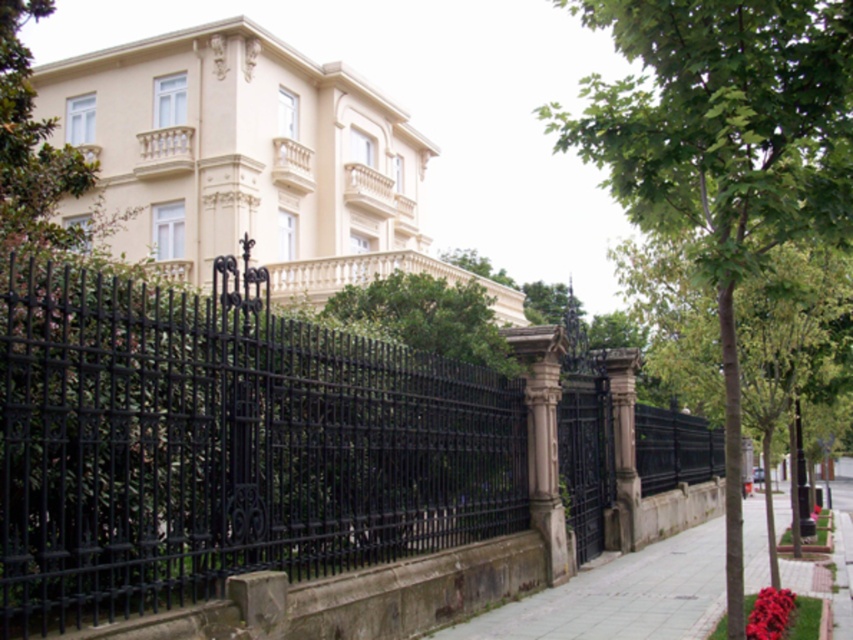
Question: Is black wrought iron fence at center further to the viewer compared to green leafy tree at center?

Choices:
 (A) yes
 (B) no

Answer: (B)

Question: Is black wrought iron fence at center to the left of green leafy tree at center from the viewer's perspective?

Choices:
 (A) no
 (B) yes

Answer: (B)

Question: Considering the relative positions of black wrought iron fence at center and green leafy tree at center in the image provided, where is black wrought iron fence at center located with respect to green leafy tree at center?

Choices:
 (A) right
 (B) left

Answer: (B)

Question: Which of the following is the farthest from the observer?

Choices:
 (A) (828, 150)
 (B) (85, 333)

Answer: (A)

Question: Which point is closer to the camera?

Choices:
 (A) black wrought iron fence at center
 (B) green leafy tree at center

Answer: (A)